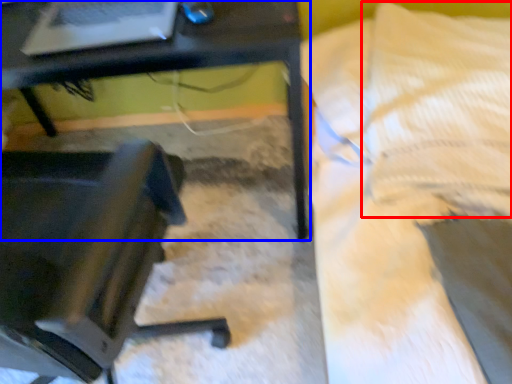
Question: Which object is further to the camera taking this photo, pillow (highlighted by a red box) or table (highlighted by a blue box)?

Choices:
 (A) pillow
 (B) table

Answer: (A)